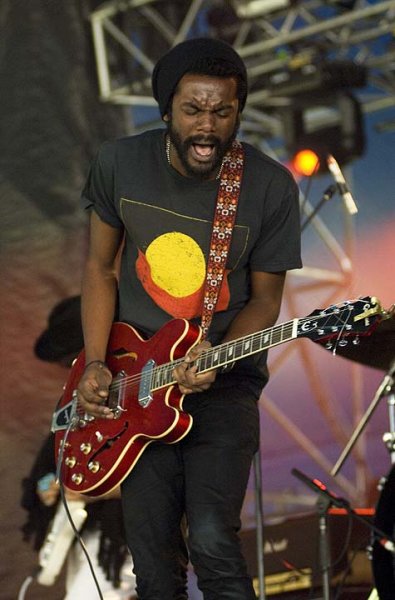
At what (x,y) coordinates should I click in order to perform the action: click on cord. Please return your answer as a coordinate pair (x, y). The height and width of the screenshot is (600, 395). Looking at the image, I should click on (92, 569).